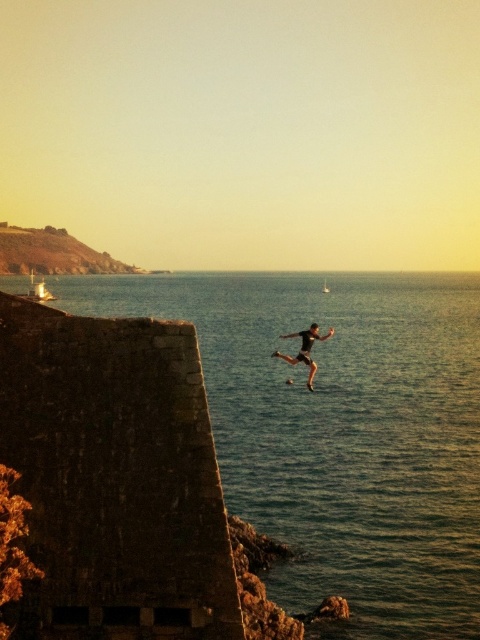
You are standing at the center of the image and want to reach the blue water at center. In which direction should you move?

The blue water at center is already at the center of the image, so you are already facing it.